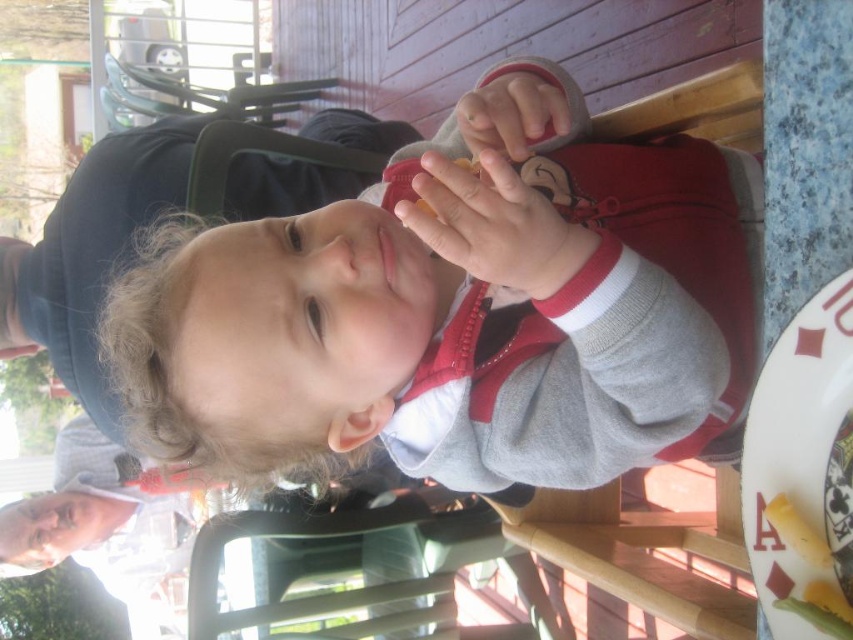
You are a photographer trying to capture a closeup of the yellow matte corn at lower right without including the gray fleece jacket at center in the frame. Given their sizes, can you fit the corn into the shot while excluding the jacket?

The gray fleece jacket at center is wider than the yellow matte corn at lower right. Since the jacket is wider, it would take up more space in the frame, making it harder to exclude. However, focusing on the corn at lower right and adjusting the camera angle to avoid the jacket might work if there is enough distance between them.

You are a photographer trying to capture a closeup shot of the yellow matte corn at lower right without including the matte plastic phone at upper center in the frame. Given their sizes, is it possible to do so?

The matte plastic phone at upper center is wider than the yellow matte corn at lower right. Since the phone is wider, it can potentially block the corn if positioned between the camera and the corn. However, since the phone is at upper center and the corn is at lower right, adjusting the camera angle to focus on the lower right area might allow capturing the corn without the phone in the frame, provided their positions don not overlap spatially.

You are a photographer trying to capture the child eating. You have a camera with a lens that can only focus on objects smaller than 20 inches. The gray fleece jacket at center and the white glossy plate at lower right are in your frame. Can both objects be in focus?

The gray fleece jacket at center is larger in size than the white glossy plate at lower right. Since the camera lens can only focus on objects smaller than 20 inches, and the jacket is larger than the plate, the plate might be within the focus range, but the jacket may exceed it. However, without knowing the exact size of the jacket, we cannot definitively say if both can be in focus. The answer is inconclusive based on the given information.